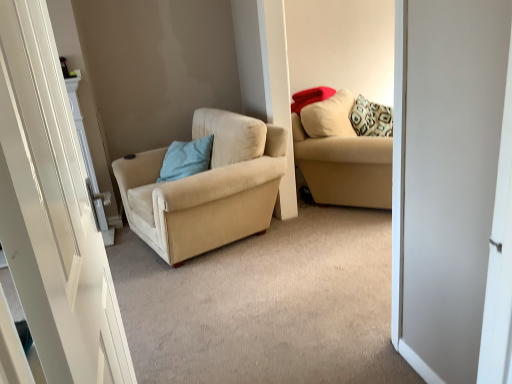
Question: Is matte red pillow at upper right, placed as the 2th pillow when sorted from bottom to top, positioned before beige fabric chair at center?

Choices:
 (A) no
 (B) yes

Answer: (A)

Question: Considering the relative sizes of matte red pillow at upper right, arranged as the 1th pillow when viewed from the right, and beige fabric chair at center in the image provided, is matte red pillow at upper right, arranged as the 1th pillow when viewed from the right, wider than beige fabric chair at center?

Choices:
 (A) yes
 (B) no

Answer: (B)

Question: Is matte red pillow at upper right, arranged as the 1th pillow when viewed from the right, facing towards beige fabric chair at center?

Choices:
 (A) no
 (B) yes

Answer: (A)

Question: Is matte red pillow at upper right, placed as the 2th pillow when sorted from bottom to top, behind beige fabric chair at center?

Choices:
 (A) yes
 (B) no

Answer: (A)

Question: Does matte red pillow at upper right, placed as the 2th pillow when sorted from bottom to top, appear on the left side of beige fabric chair at center?

Choices:
 (A) no
 (B) yes

Answer: (A)

Question: In terms of size, does matte red pillow at upper right, which ranks as the second pillow in left-to-right order, appear bigger or smaller than beige fabric couch at upper right?

Choices:
 (A) big
 (B) small

Answer: (B)

Question: Which is correct: matte red pillow at upper right, marked as the first pillow in a top-to-bottom arrangement, is inside beige fabric couch at upper right, or outside of it?

Choices:
 (A) inside
 (B) outside

Answer: (A)

Question: Looking at their shapes, would you say matte red pillow at upper right, placed as the 2th pillow when sorted from bottom to top, is wider or thinner than beige fabric couch at upper right?

Choices:
 (A) thin
 (B) wide

Answer: (A)

Question: From a real-world perspective, is matte red pillow at upper right, arranged as the 1th pillow when viewed from the right, above or below beige fabric couch at upper right?

Choices:
 (A) below
 (B) above

Answer: (B)

Question: Considering the positions of point (72, 233) and point (248, 147), is point (72, 233) closer or farther from the camera than point (248, 147)?

Choices:
 (A) closer
 (B) farther

Answer: (A)

Question: From a real-world perspective, is white glossy door at left physically located above or below beige fabric chair at center?

Choices:
 (A) above
 (B) below

Answer: (A)

Question: In terms of size, does white glossy door at left appear bigger or smaller than beige fabric chair at center?

Choices:
 (A) small
 (B) big

Answer: (A)

Question: Is white glossy door at left spatially inside beige fabric chair at center, or outside of it?

Choices:
 (A) inside
 (B) outside

Answer: (B)

Question: Considering the positions of point click(60, 291) and point click(297, 100), is point click(60, 291) closer or farther from the camera than point click(297, 100)?

Choices:
 (A) farther
 (B) closer

Answer: (B)

Question: Looking at the image, does white glossy door at left seem bigger or smaller compared to matte red pillow at upper right, marked as the first pillow in a top-to-bottom arrangement?

Choices:
 (A) big
 (B) small

Answer: (A)